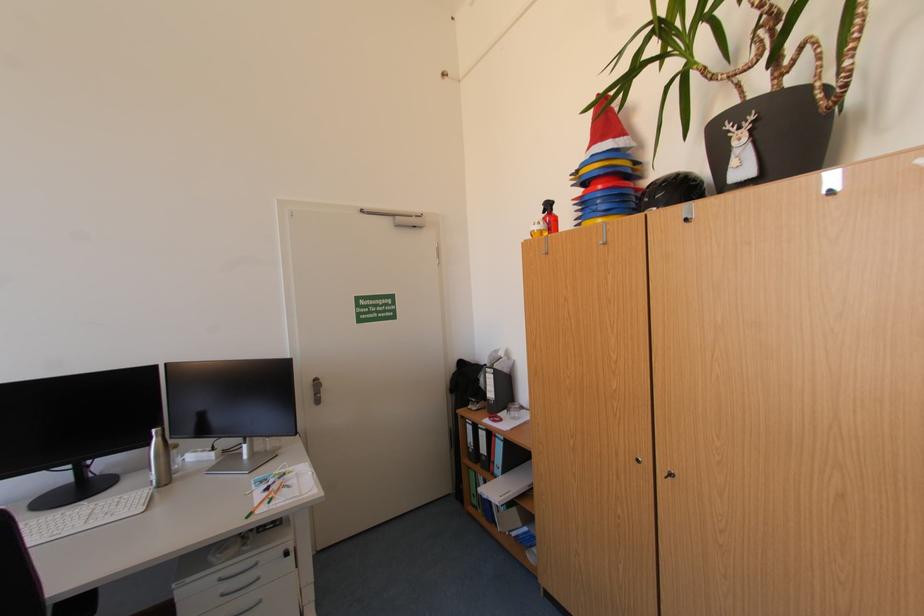
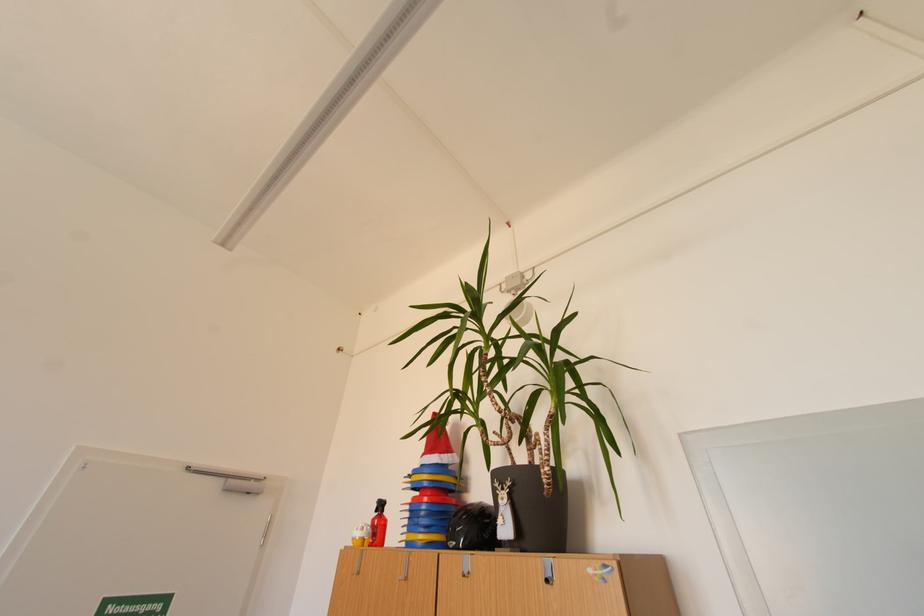
The point at [606,203] is marked in the first image. Where is the corresponding point in the second image?

(431, 514)